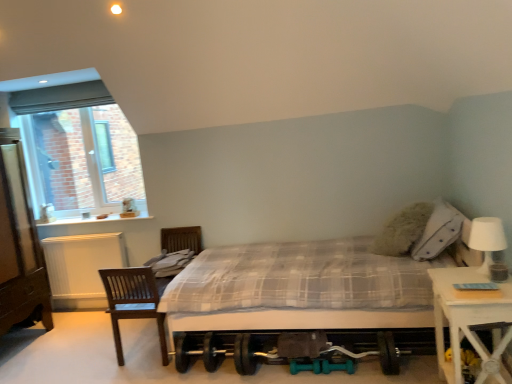
Question: Is white wood nightstand at right positioned with its back to white matte table lamp at right?

Choices:
 (A) yes
 (B) no

Answer: (B)

Question: From the image's perspective, is white wood nightstand at right on white matte table lamp at right?

Choices:
 (A) no
 (B) yes

Answer: (A)

Question: From a real-world perspective, is white wood nightstand at right physically below white matte table lamp at right?

Choices:
 (A) yes
 (B) no

Answer: (A)

Question: From the image's perspective, is white wood nightstand at right below white matte table lamp at right?

Choices:
 (A) yes
 (B) no

Answer: (A)

Question: Can you confirm if white wood nightstand at right is positioned to the left of white matte table lamp at right?

Choices:
 (A) no
 (B) yes

Answer: (B)

Question: Does white wood nightstand at right have a lesser width compared to white matte table lamp at right?

Choices:
 (A) no
 (B) yes

Answer: (A)

Question: Is the position of plaid fabric bed at center less distant than that of white plastic window at upper left?

Choices:
 (A) no
 (B) yes

Answer: (B)

Question: Is plaid fabric bed at center turned away from white plastic window at upper left?

Choices:
 (A) no
 (B) yes

Answer: (A)

Question: Is plaid fabric bed at center taller than white plastic window at upper left?

Choices:
 (A) no
 (B) yes

Answer: (A)

Question: Is plaid fabric bed at center shorter than white plastic window at upper left?

Choices:
 (A) no
 (B) yes

Answer: (B)

Question: Is plaid fabric bed at center aimed at white plastic window at upper left?

Choices:
 (A) no
 (B) yes

Answer: (A)

Question: From a real-world perspective, is plaid fabric bed at center over white plastic window at upper left?

Choices:
 (A) yes
 (B) no

Answer: (B)

Question: From the image's perspective, is white plastic window at upper left located beneath white matte table lamp at right?

Choices:
 (A) yes
 (B) no

Answer: (B)